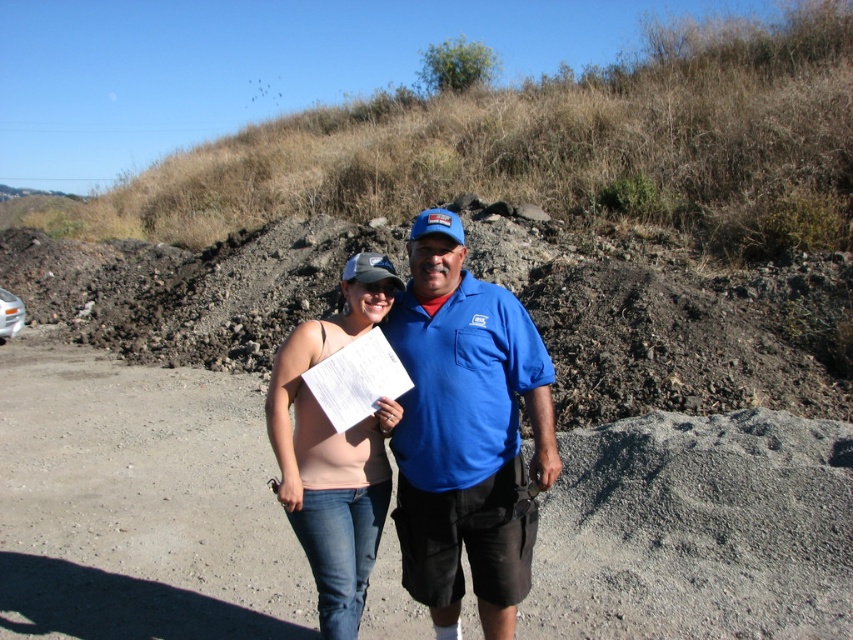
Question: Can you confirm if dirt track at center is thinner than blue cotton shirt at center?

Choices:
 (A) no
 (B) yes

Answer: (A)

Question: Does blue cotton shirt at center come behind matte pink tank top at center?

Choices:
 (A) yes
 (B) no

Answer: (B)

Question: Among these objects, which one is nearest to the camera?

Choices:
 (A) blue cotton shirt at center
 (B) matte pink tank top at center
 (C) dirt track at center

Answer: (A)

Question: Which of these objects is positioned farthest from the matte pink tank top at center?

Choices:
 (A) dirt track at center
 (B) blue cotton shirt at center

Answer: (A)

Question: Is blue cotton shirt at center behind matte pink tank top at center?

Choices:
 (A) yes
 (B) no

Answer: (B)

Question: Considering the real-world distances, which object is closest to the blue cotton shirt at center?

Choices:
 (A) matte pink tank top at center
 (B) dirt track at center

Answer: (A)